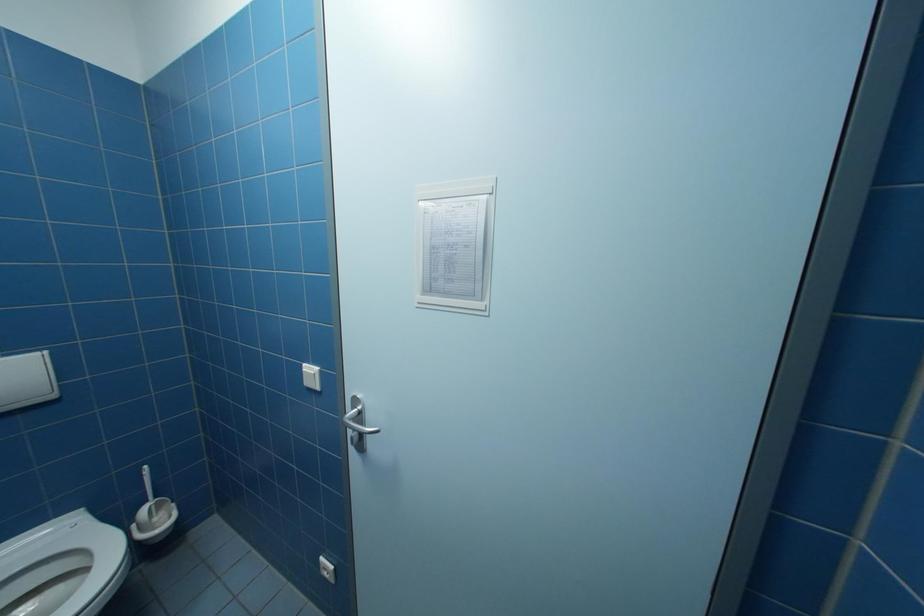
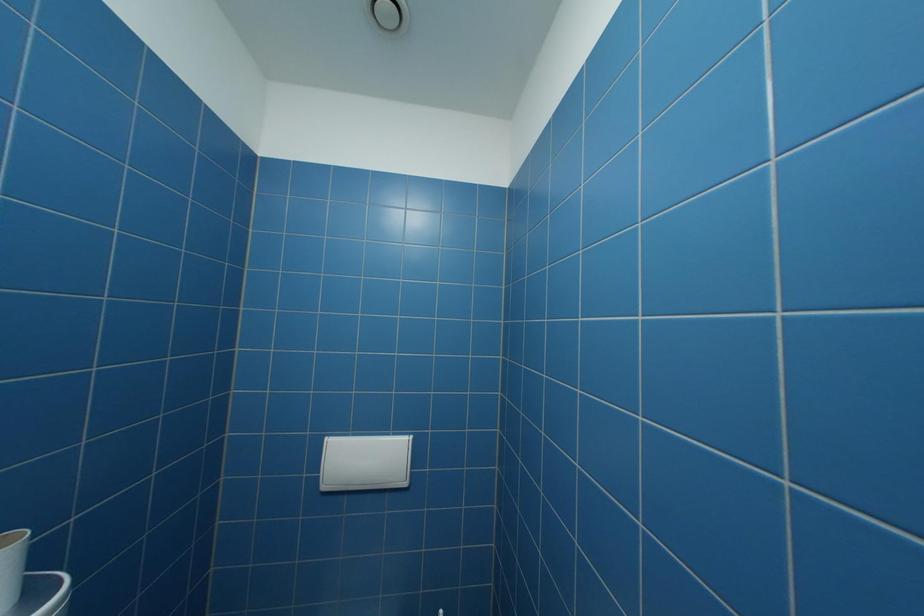
Question: The camera is either moving clockwise (left) or counter-clockwise (right) around the object. The first image is from the beginning of the video and the second image is from the end. Is the camera moving left or right when shooting the video?

Choices:
 (A) Left
 (B) Right

Answer: (B)